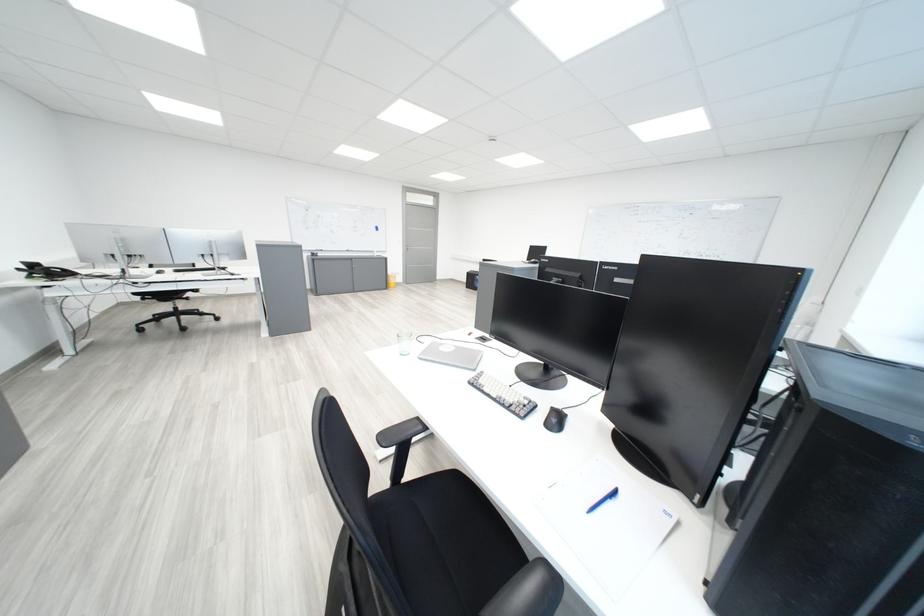
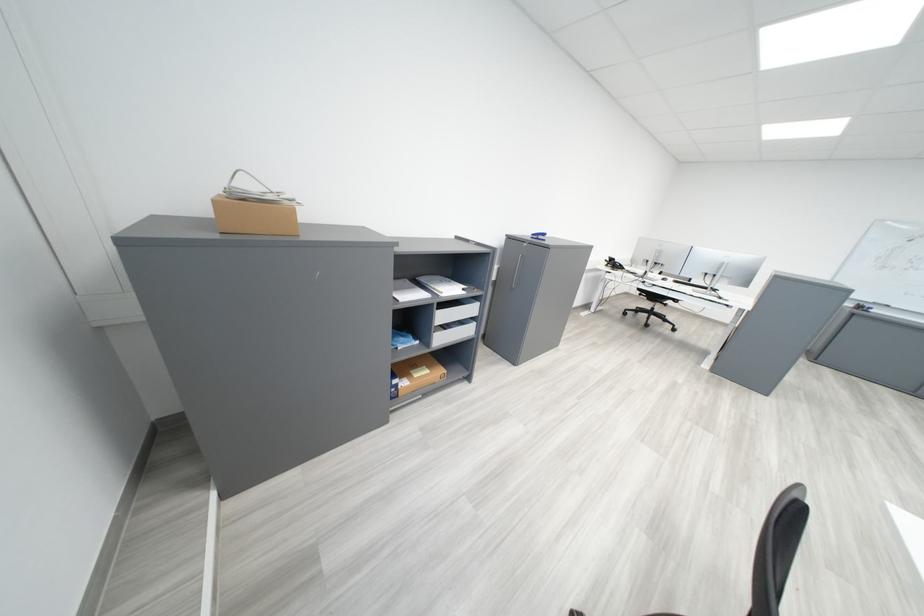
Based on the continuous images, in which direction is the camera rotating?

The camera's rotation is toward left-down.